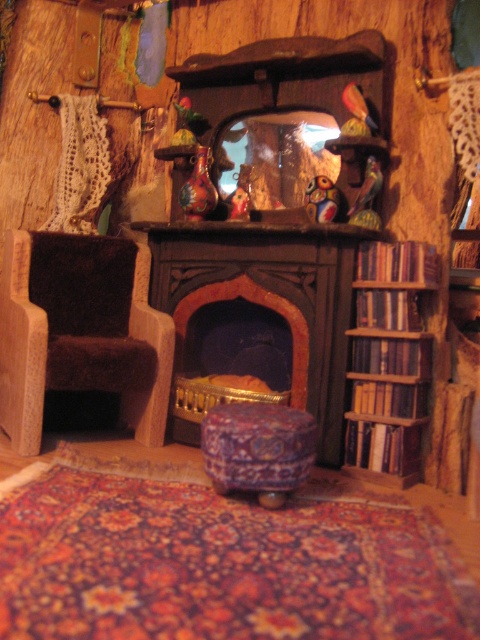
Which of these two, dark wood fireplace at center or brown fuzzy armchair at left, stands shorter?

With less height is brown fuzzy armchair at left.

In the scene shown: Is dark wood fireplace at center positioned at the back of brown fuzzy armchair at left?

No, dark wood fireplace at center is in front of brown fuzzy armchair at left.

The height and width of the screenshot is (640, 480). Describe the element at coordinates (257, 314) in the screenshot. I see `dark wood fireplace at center` at that location.

Where is `dark wood fireplace at center`? This screenshot has width=480, height=640. dark wood fireplace at center is located at coordinates (257, 314).

Does dark wood fireplace at center appear over carpeted fabric stool at center?

Correct, dark wood fireplace at center is located above carpeted fabric stool at center.

Is dark wood fireplace at center positioned before carpeted fabric stool at center?

No.

Which is behind, point (290, 273) or point (207, 422)?

Point (290, 273)

Where is `dark wood fireplace at center`? Image resolution: width=480 pixels, height=640 pixels. dark wood fireplace at center is located at coordinates (257, 314).

Is wooden bookshelf at right positioned behind carpeted fabric stool at center?

Yes.

Is wooden bookshelf at right thinner than carpeted fabric stool at center?

Indeed, wooden bookshelf at right has a lesser width compared to carpeted fabric stool at center.

What are the coordinates of `wooden bookshelf at right` in the screenshot? It's located at (388, 360).